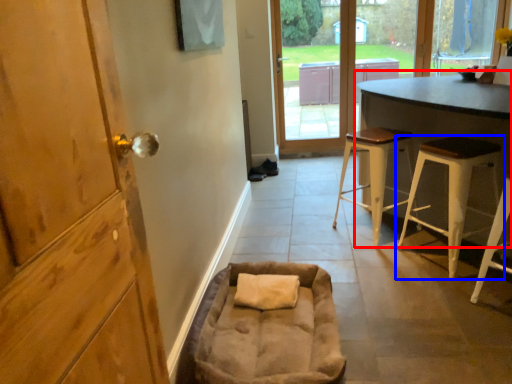
Question: Among these objects, which one is nearest to the camera, table (highlighted by a red box) or stool (highlighted by a blue box)?

Choices:
 (A) table
 (B) stool

Answer: (A)